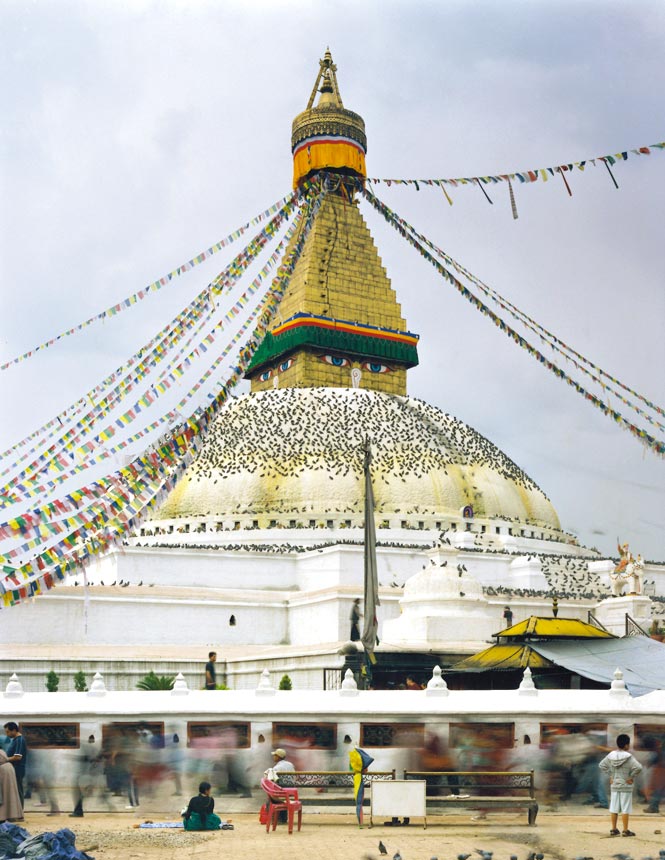
Where is `bench`? bench is located at coordinates (467, 799), (322, 797).